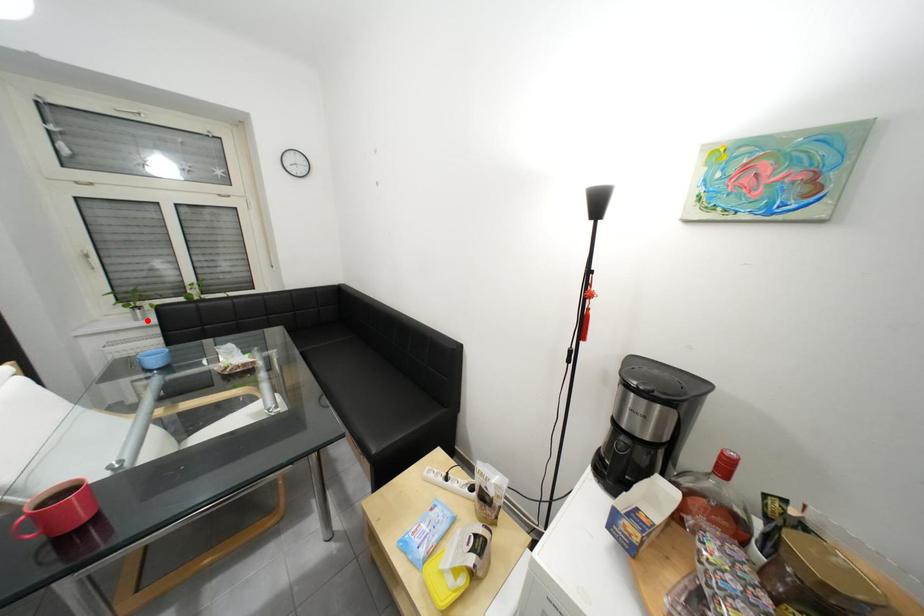
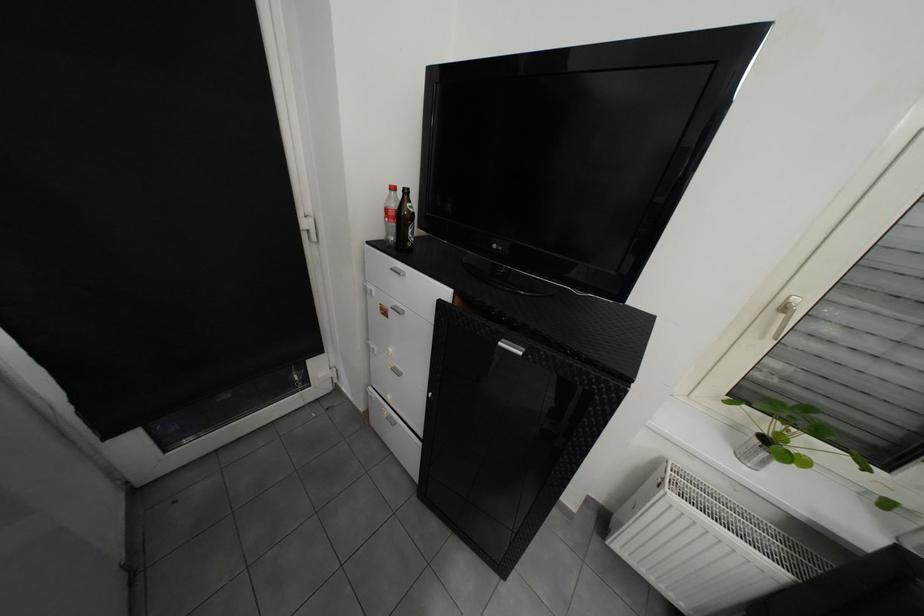
Find the pixel in the second image that matches the highlighted location in the first image.

(754, 458)